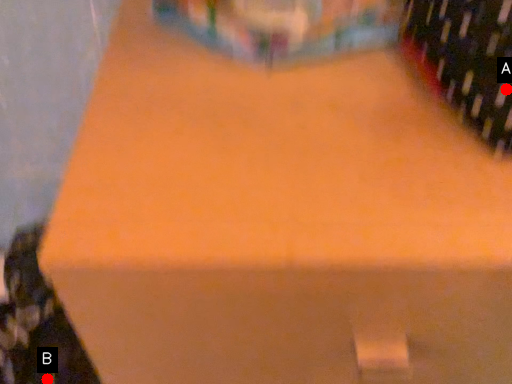
Question: Two points are circled on the image, labeled by A and B beside each circle. Which of the following is the closest to the observer?

Choices:
 (A) A is closer
 (B) B is closer

Answer: (A)